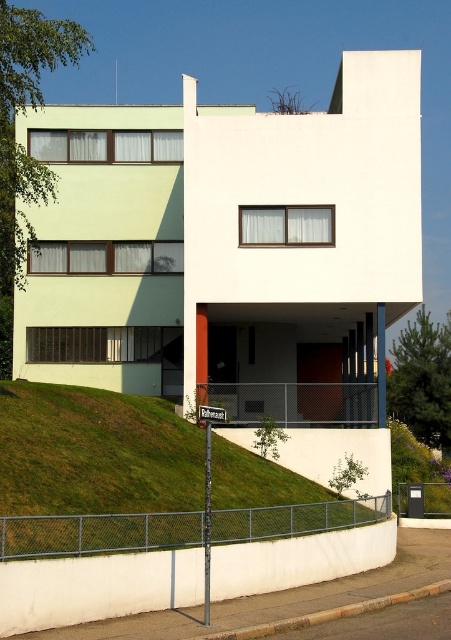
In the scene shown: Which is more to the left, chain-link fence at lower right or metallic chain-link fence at lower center?

chain-link fence at lower right

Does chain-link fence at lower right have a greater width compared to metallic chain-link fence at lower center?

Yes.

Identify the location of chain-link fence at lower right. (97, 532).

Locate an element on the screen. chain-link fence at lower right is located at coordinates (97, 532).

The height and width of the screenshot is (640, 451). Describe the element at coordinates (95, 472) in the screenshot. I see `green grass at lower left` at that location.

Which is behind, point (214, 461) or point (233, 387)?

The point (233, 387) is more distant.

At what (x,y) coordinates should I click in order to perform the action: click on green grass at lower left. Please return your answer as a coordinate pair (x, y). This screenshot has width=451, height=640. Looking at the image, I should click on (95, 472).

Where is `green grass at lower left`? green grass at lower left is located at coordinates (95, 472).

Does green grass at lower left appear on the left side of chain-link fence at lower right?

Yes, green grass at lower left is to the left of chain-link fence at lower right.

Who is higher up, green grass at lower left or chain-link fence at lower right?

green grass at lower left

Is point (19, 452) positioned in front of point (61, 515)?

No, it is behind (61, 515).

The height and width of the screenshot is (640, 451). Find the location of `green grass at lower left`. green grass at lower left is located at coordinates 95,472.